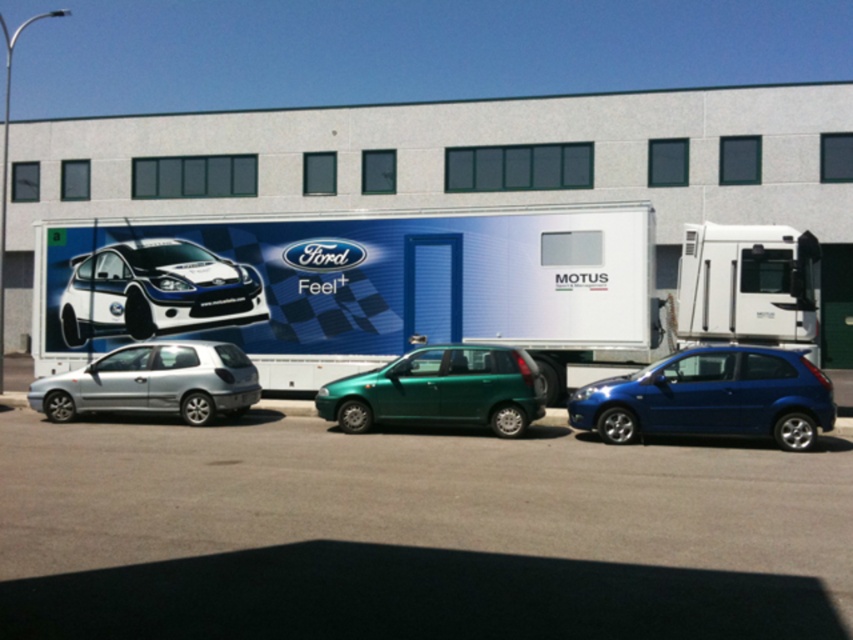
Question: Which object appears farthest from the camera in this image?

Choices:
 (A) white glossy truck at center
 (B) white glossy rally car at left
 (C) silver metallic hatchback at left

Answer: (B)

Question: Does white glossy truck at center come behind silver metallic hatchback at left?

Choices:
 (A) yes
 (B) no

Answer: (A)

Question: Based on their relative distances, which object is nearer to the white glossy rally car at left?

Choices:
 (A) silver metallic hatchback at left
 (B) white glossy truck at center
 (C) metallic silver car at center

Answer: (B)

Question: Is blue metallic hatchback at right positioned before metallic green hatchback at center?

Choices:
 (A) yes
 (B) no

Answer: (A)

Question: Which point is farther to the camera?

Choices:
 (A) white glossy truck at center
 (B) silver metallic hatchback at left
 (C) metallic silver car at center
 (D) metallic green hatchback at center

Answer: (A)

Question: Can you confirm if blue metallic hatchback at right is wider than silver metallic hatchback at left?

Choices:
 (A) no
 (B) yes

Answer: (A)